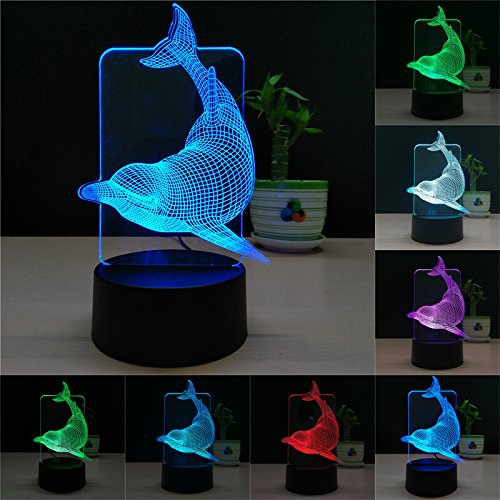
The height and width of the screenshot is (500, 500). I want to click on pot, so click(308, 228).